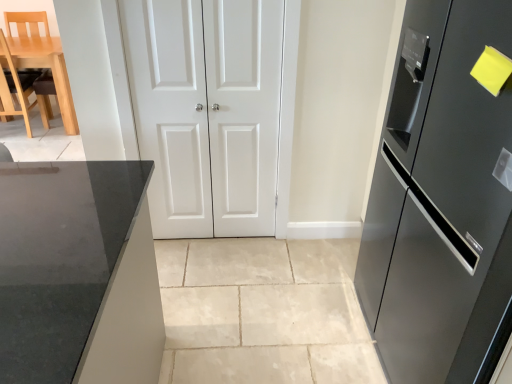
Question: From the image's perspective, would you say white glossy door at center, which is counted as the first door, starting from the left, is positioned over white matte door at center, which is the second door in left-to-right order?

Choices:
 (A) no
 (B) yes

Answer: (A)

Question: Is white glossy door at center, which is counted as the 2th door, starting from the right, behind white matte door at center, the 1th door in the right-to-left sequence?

Choices:
 (A) yes
 (B) no

Answer: (B)

Question: Does white glossy door at center, which is counted as the first door, starting from the left, lie in front of white matte door at center, the 1th door in the right-to-left sequence?

Choices:
 (A) no
 (B) yes

Answer: (B)

Question: Is white glossy door at center, which is counted as the first door, starting from the left, at the right side of white matte door at center, which is the second door in left-to-right order?

Choices:
 (A) no
 (B) yes

Answer: (A)

Question: Can you confirm if white glossy door at center, which is counted as the first door, starting from the left, is taller than white matte door at center, which is the second door in left-to-right order?

Choices:
 (A) no
 (B) yes

Answer: (B)

Question: Considering their positions, is satin black refrigerator at right located in front of or behind white matte door at center, which is the second door in left-to-right order?

Choices:
 (A) front
 (B) behind

Answer: (A)

Question: In terms of size, does satin black refrigerator at right appear bigger or smaller than white matte door at center, which is the second door in left-to-right order?

Choices:
 (A) big
 (B) small

Answer: (A)

Question: Considering the relative positions of satin black refrigerator at right and white matte door at center, which is the second door in left-to-right order, in the image provided, is satin black refrigerator at right to the left or to the right of white matte door at center, which is the second door in left-to-right order,?

Choices:
 (A) right
 (B) left

Answer: (A)

Question: From the image's perspective, relative to white matte door at center, the 1th door in the right-to-left sequence, is satin black refrigerator at right above or below?

Choices:
 (A) above
 (B) below

Answer: (B)

Question: Is light wood/leather chair at left to the left or to the right of white matte door at center, the 1th door in the right-to-left sequence, in the image?

Choices:
 (A) left
 (B) right

Answer: (A)

Question: In the image, is light wood/leather chair at left positioned in front of or behind white matte door at center, which is the second door in left-to-right order?

Choices:
 (A) behind
 (B) front

Answer: (A)

Question: Is light wood/leather chair at left taller or shorter than white matte door at center, which is the second door in left-to-right order?

Choices:
 (A) tall
 (B) short

Answer: (B)

Question: Looking at the image, does light wood/leather chair at left seem bigger or smaller compared to white matte door at center, which is the second door in left-to-right order?

Choices:
 (A) big
 (B) small

Answer: (A)

Question: Do you think white glossy door at center, which is counted as the first door, starting from the left, is within satin black refrigerator at right, or outside of it?

Choices:
 (A) outside
 (B) inside

Answer: (A)

Question: From a real-world perspective, relative to satin black refrigerator at right, is white glossy door at center, which is counted as the first door, starting from the left, vertically above or below?

Choices:
 (A) above
 (B) below

Answer: (B)